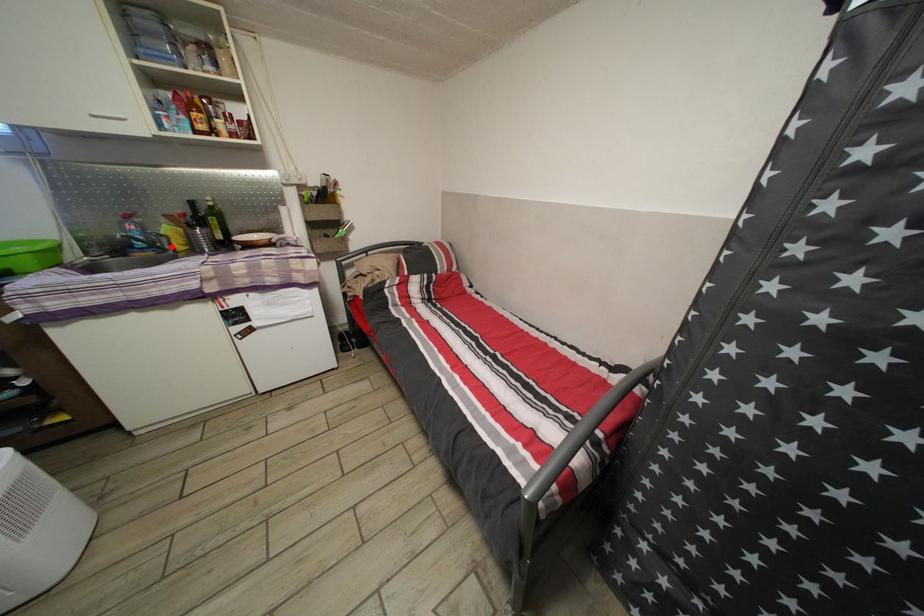
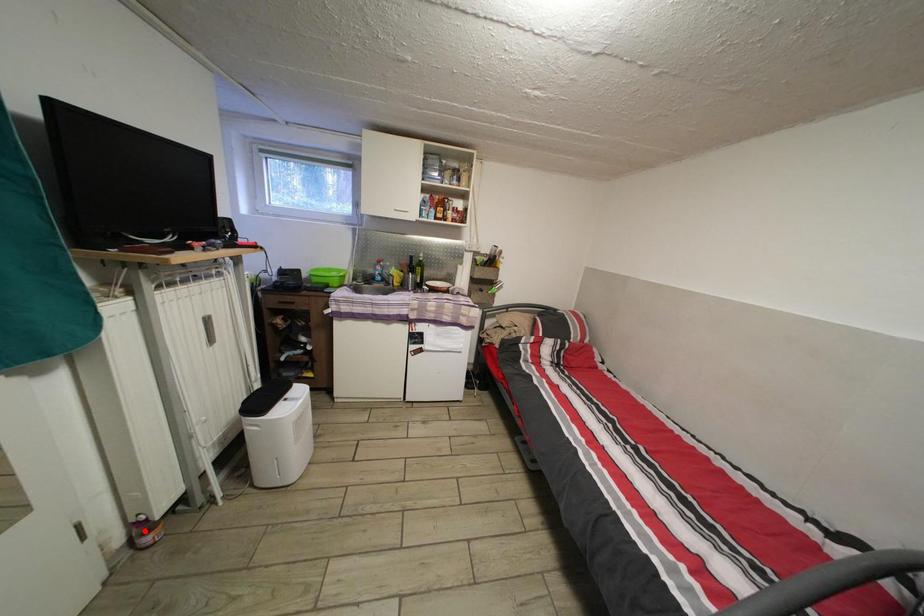
I am providing you with two images of the same scene from different viewpoints. A red point is marked on the first image and another point is marked on the second image. Is the red point in image1 aligned with the point shown in image2?

No